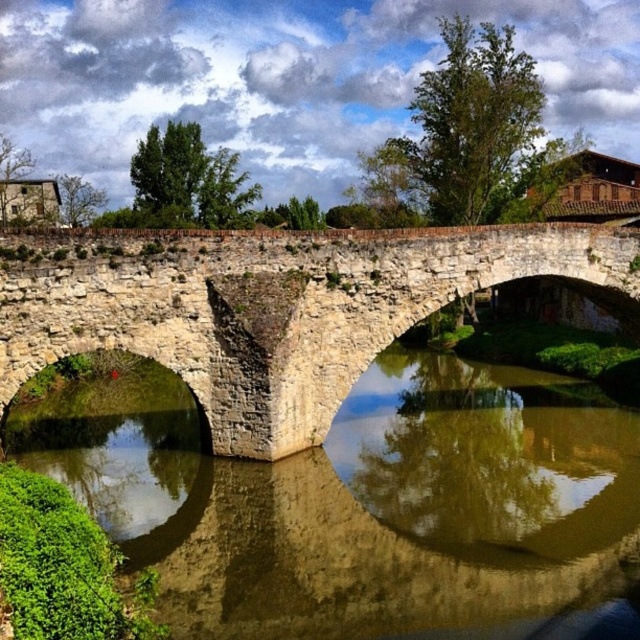
Is brown stone water at center bigger than stone arch bridge at center?

Yes, brown stone water at center is bigger than stone arch bridge at center.

Does point (97, 424) lie in front of point (204, 381)?

No.

From the picture: Measure the distance between brown stone water at center and camera.

They are 21.31 meters apart.

I want to click on brown stone water at center, so click(358, 500).